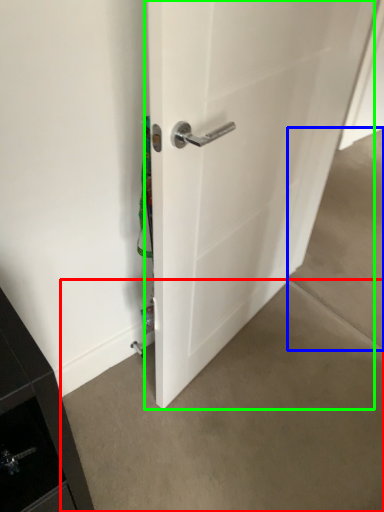
Question: Which is farther away from concrete (highlighted by a red box)? concrete (highlighted by a blue box) or door (highlighted by a green box)?

Choices:
 (A) concrete
 (B) door

Answer: (A)